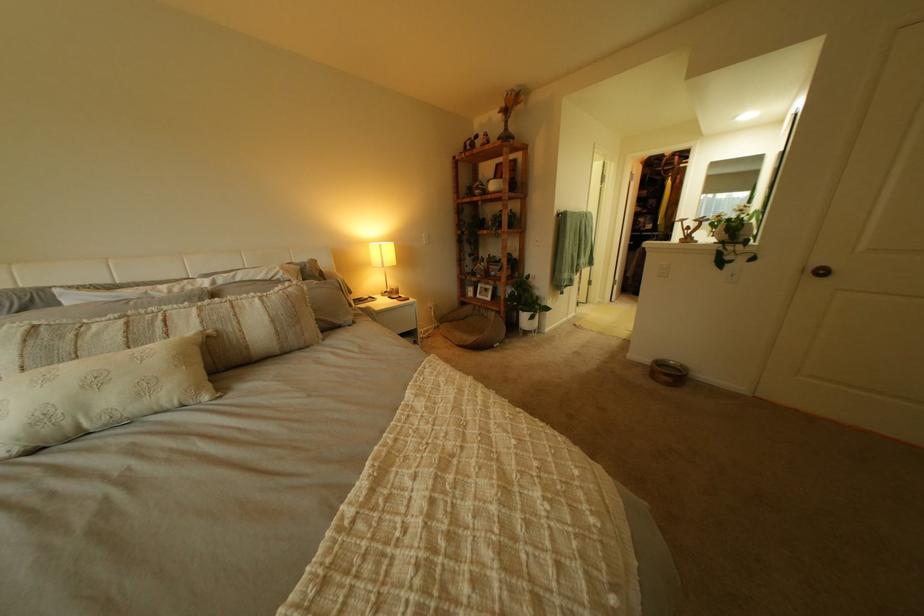
Find where to lift the small picture frame. Please return your answer as a coordinate pair (x, y).

(483, 291)